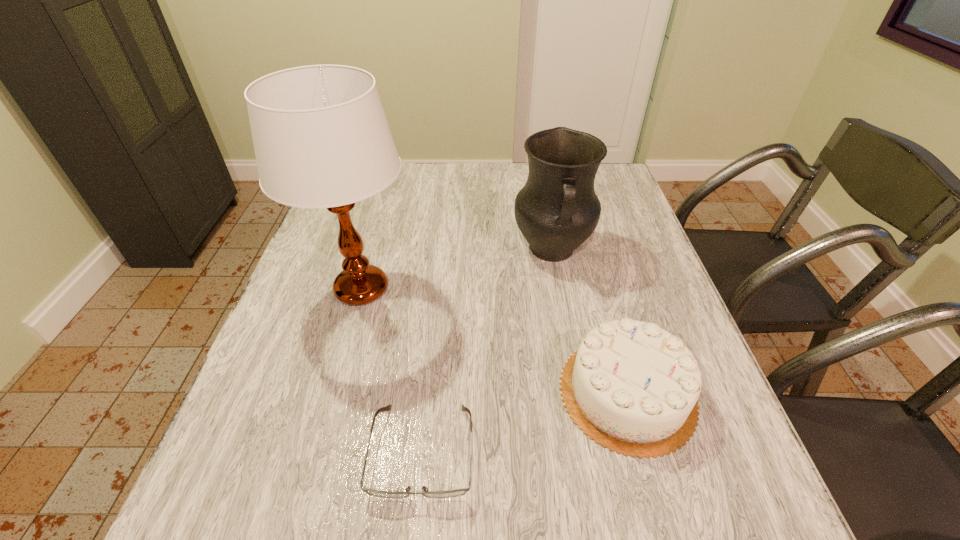
Find the location of a particular element. empty space that is in between the pitcher and the shortest object is located at coordinates (487, 350).

In order to click on vacant area between the pitcher and the birthday cake in this screenshot , I will do `click(589, 321)`.

Identify the location of vacant area between the tallest object and the third tallest object. The image size is (960, 540). (494, 341).

Identify the location of empty space that is in between the birthday cake and the spectacles. Image resolution: width=960 pixels, height=540 pixels. (525, 422).

Image resolution: width=960 pixels, height=540 pixels. In order to click on free spot between the table lamp and the shortest object in this screenshot , I will do `click(392, 370)`.

This screenshot has height=540, width=960. What are the coordinates of `free space between the third tallest object and the spectacles` in the screenshot? It's located at (525, 422).

Identify which object is located as the nearest to the tallest object. Please provide its 2D coordinates. Your answer should be formatted as a tuple, i.e. [(x, y)], where the tuple contains the x and y coordinates of a point satisfying the conditions above.

[(459, 492)]

Point out which object is positioned as the third nearest to the pitcher. Please provide its 2D coordinates. Your answer should be formatted as a tuple, i.e. [(x, y)], where the tuple contains the x and y coordinates of a point satisfying the conditions above.

[(459, 492)]

At what (x,y) coordinates should I click in order to perform the action: click on free space that satisfies the following two spatial constraints: 1. on the handle side of the second shortest object; 2. on the right side of the pitcher. Please return your answer as a coordinate pair (x, y). This screenshot has height=540, width=960. Looking at the image, I should click on (579, 393).